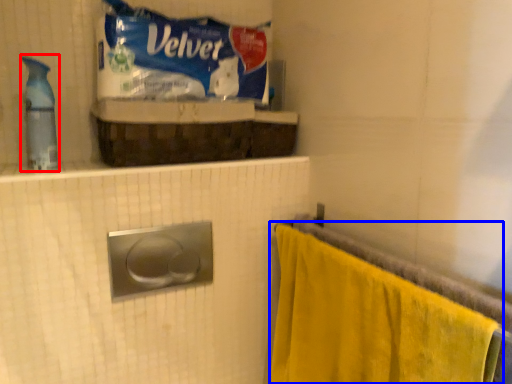
Question: Which of the following is the closest to the observer, cleaning product (highlighted by a red box) or towel (highlighted by a blue box)?

Choices:
 (A) cleaning product
 (B) towel

Answer: (B)